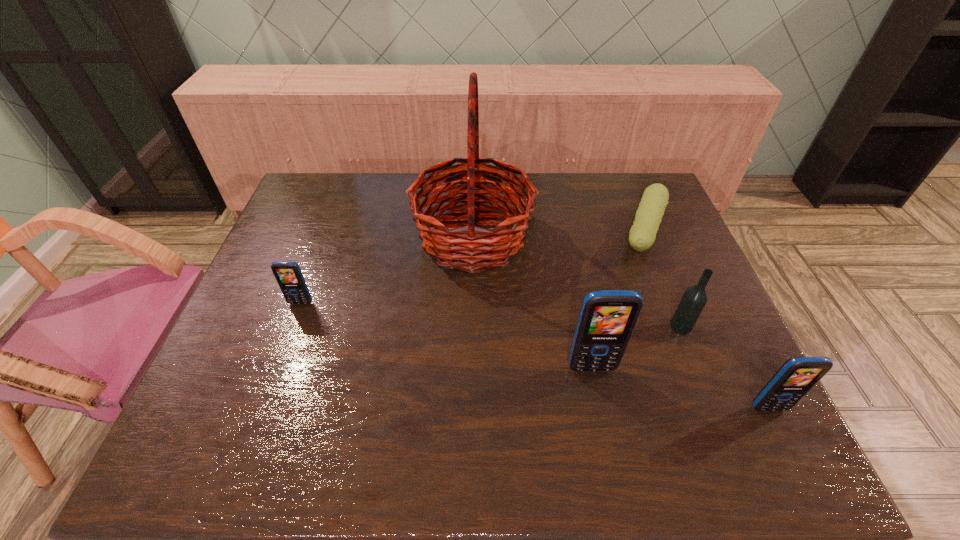
Find the location of a particular element. The height and width of the screenshot is (540, 960). free space between the vodka and the basket is located at coordinates (577, 282).

Locate an element on the screen. The image size is (960, 540). vacant point located between the nearest object and the fifth shortest object is located at coordinates (680, 388).

Locate an element on the screen. The image size is (960, 540). unoccupied position between the tallest object and the second cellular telephone from right to left is located at coordinates (532, 303).

Image resolution: width=960 pixels, height=540 pixels. I want to click on free point between the cucumber and the tallest object, so click(x=559, y=235).

You are a GUI agent. You are given a task and a screenshot of the screen. Output one action in this format:
    pyautogui.click(x=<x>, y=<y>)
    Task: Click on the empty space between the third farthest object and the vodka
    This screenshot has width=960, height=540.
    Given the screenshot: What is the action you would take?
    coord(491,315)

I want to click on free space between the fifth farthest object and the farthest cellular telephone, so click(446, 336).

Image resolution: width=960 pixels, height=540 pixels. Identify the location of free point between the fourth farthest object and the tallest cellular telephone. (636, 347).

Identify which object is the fourth closest to the nearest cellular telephone. Please provide its 2D coordinates. Your answer should be formatted as a tuple, i.e. [(x, y)], where the tuple contains the x and y coordinates of a point satisfying the conditions above.

[(467, 248)]

Where is `object that ranks as the second closest to the tallest cellular telephone`? object that ranks as the second closest to the tallest cellular telephone is located at coordinates (467, 248).

Locate which cellular telephone ranks in proximity to the cucumber. Please provide its 2D coordinates. Your answer should be formatted as a tuple, i.e. [(x, y)], where the tuple contains the x and y coordinates of a point satisfying the conditions above.

[(607, 318)]